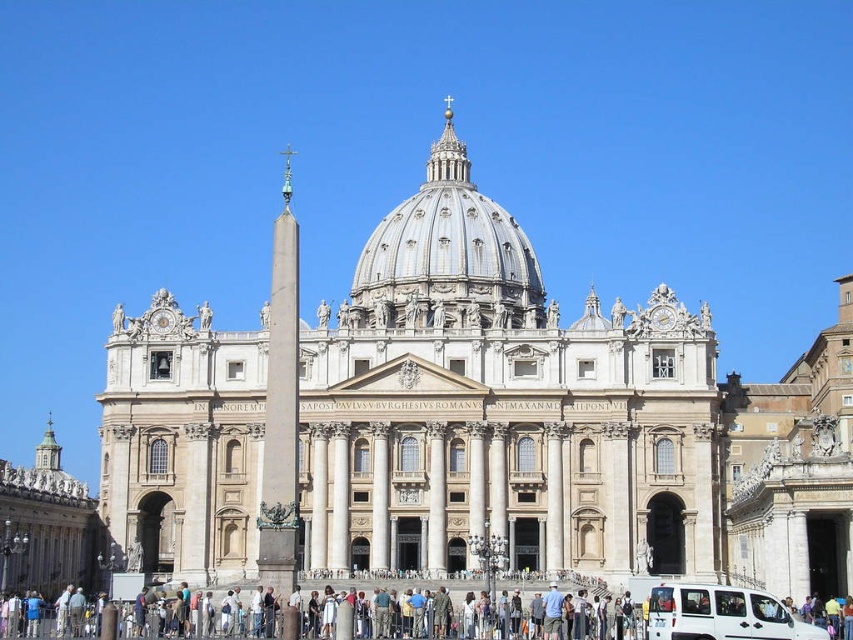
Which is more to the left, white marble church at center or silver metallic dome at center?

white marble church at center is more to the left.

Can you confirm if white marble church at center is positioned to the right of silver metallic dome at center?

No, white marble church at center is not to the right of silver metallic dome at center.

What do you see at coordinates (498, 406) in the screenshot? I see `white marble church at center` at bounding box center [498, 406].

Locate an element on the screen. white marble church at center is located at coordinates (498, 406).

Does beige stone church at right have a larger size compared to white matte van at lower center?

Yes, beige stone church at right is bigger than white matte van at lower center.

Is point (820, 572) farther from viewer compared to point (764, 612)?

Yes, it is behind point (764, 612).

Find the location of a particular element. Image resolution: width=853 pixels, height=640 pixels. beige stone church at right is located at coordinates (793, 468).

Is white marble church at center to the left of beige stone church at right from the viewer's perspective?

Yes, white marble church at center is to the left of beige stone church at right.

Who is lower down, white marble church at center or beige stone church at right?

Positioned lower is beige stone church at right.

Is point (683, 305) farther from viewer compared to point (729, 448)?

That is True.

In order to click on white marble church at center in this screenshot , I will do `click(498, 406)`.